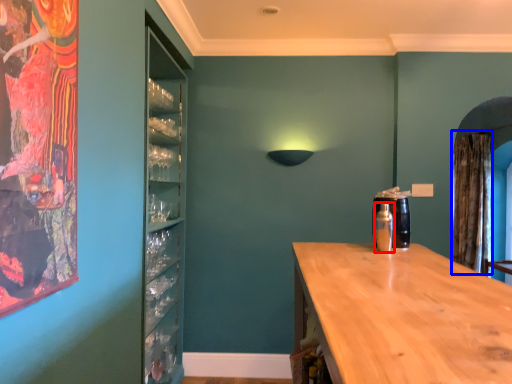
Question: Among these objects, which one is farthest to the camera, bottle (highlighted by a red box) or curtain (highlighted by a blue box)?

Choices:
 (A) bottle
 (B) curtain

Answer: (B)